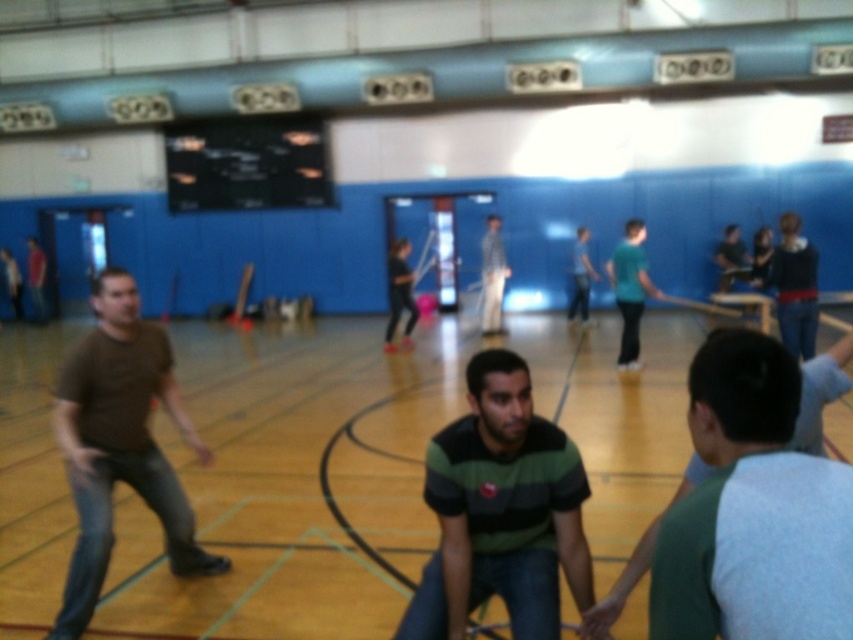
Who is positioned more to the left, green striped shirt at center or brown matte shirt at left?

From the viewer's perspective, brown matte shirt at left appears more on the left side.

This screenshot has height=640, width=853. Describe the element at coordinates (502, 512) in the screenshot. I see `green striped shirt at center` at that location.

Which is behind, point (483, 464) or point (91, 577)?

The point (91, 577) is more distant.

Identify the location of green striped shirt at center. This screenshot has width=853, height=640. (502, 512).

Does point (689, 496) lie in front of point (512, 420)?

Yes, point (689, 496) is closer to viewer.

Is gray-green striped shirt at center thinner than green striped shirt at center?

Yes, gray-green striped shirt at center is thinner than green striped shirt at center.

This screenshot has height=640, width=853. Describe the element at coordinates (753, 512) in the screenshot. I see `gray-green striped shirt at center` at that location.

You are a GUI agent. You are given a task and a screenshot of the screen. Output one action in this format:
    pyautogui.click(x=<x>, y=<y>)
    Task: Click on the gray-green striped shirt at center
    The width and height of the screenshot is (853, 640).
    Given the screenshot: What is the action you would take?
    click(753, 512)

Is gray-green striped shirt at center above brown matte shirt at left?

Indeed, gray-green striped shirt at center is positioned over brown matte shirt at left.

Which is in front, point (759, 545) or point (152, 340)?

Point (759, 545)

Find the location of a particular element. The image size is (853, 640). gray-green striped shirt at center is located at coordinates (753, 512).